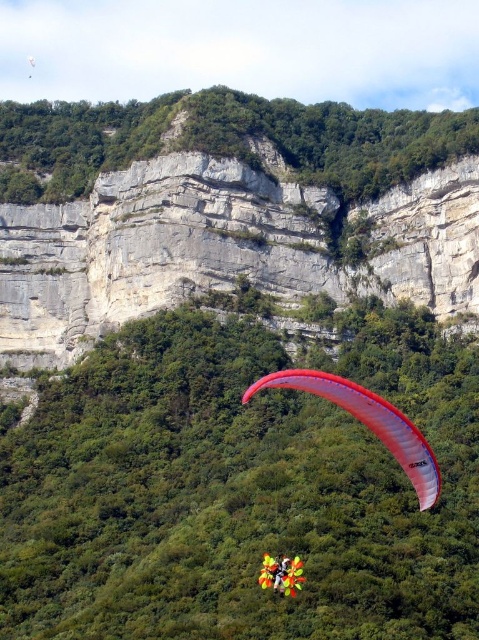
Based on the photo, does translucent red paraglider at center appear on the left side of yellow fabric parachute at center?

In fact, translucent red paraglider at center is to the right of yellow fabric parachute at center.

Can you confirm if translucent red paraglider at center is smaller than yellow fabric parachute at center?

No.

Measure the distance between point (419, 477) and camera.

76.71 meters

The height and width of the screenshot is (640, 479). In order to click on translucent red paraglider at center in this screenshot , I will do `click(367, 422)`.

From the picture: Can you confirm if rugged stone cliff at upper center is positioned below yellow fabric parachute at center?

Actually, rugged stone cliff at upper center is above yellow fabric parachute at center.

Who is lower down, rugged stone cliff at upper center or yellow fabric parachute at center?

yellow fabric parachute at center is below.

This screenshot has height=640, width=479. Find the location of `rugged stone cliff at upper center`. rugged stone cliff at upper center is located at coordinates click(x=225, y=140).

Which is more to the right, rugged stone cliff at upper center or translucent red paraglider at center?

translucent red paraglider at center

The width and height of the screenshot is (479, 640). Identify the location of rugged stone cliff at upper center. (225, 140).

Who is more forward, [194,100] or [422,448]?

Point [422,448] is more forward.

At what (x,y) coordinates should I click in order to perform the action: click on rugged stone cliff at upper center. Please return your answer as a coordinate pair (x, y). This screenshot has width=479, height=640. Looking at the image, I should click on (225, 140).